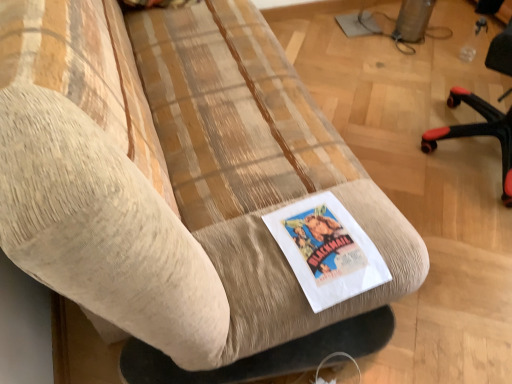
Question: In the image, is black plastic chair at right on the left side or the right side of white paper flyer at center?

Choices:
 (A) left
 (B) right

Answer: (B)

Question: Considering the positions of black plastic chair at right and white paper flyer at center in the image, is black plastic chair at right wider or thinner than white paper flyer at center?

Choices:
 (A) thin
 (B) wide

Answer: (B)

Question: Considering the positions of black plastic chair at right and white paper flyer at center in the image, is black plastic chair at right taller or shorter than white paper flyer at center?

Choices:
 (A) tall
 (B) short

Answer: (A)

Question: Considering the positions of white paper flyer at center and black plastic chair at right in the image, is white paper flyer at center bigger or smaller than black plastic chair at right?

Choices:
 (A) small
 (B) big

Answer: (A)

Question: Is point (371, 269) closer or farther from the camera than point (438, 135)?

Choices:
 (A) closer
 (B) farther

Answer: (A)

Question: From their relative heights in the image, would you say white paper flyer at center is taller or shorter than black plastic chair at right?

Choices:
 (A) short
 (B) tall

Answer: (A)

Question: In terms of width, does white paper flyer at center look wider or thinner when compared to black plastic chair at right?

Choices:
 (A) wide
 (B) thin

Answer: (B)